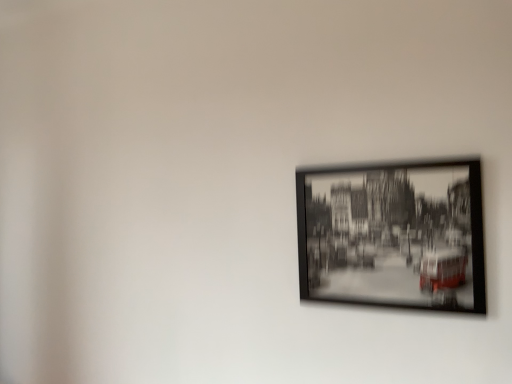
You are a GUI agent. You are given a task and a screenshot of the screen. Output one action in this format:
    pyautogui.click(x=<x>, y=<y>)
    Task: Click on the black matte picture frame at upper right
    This screenshot has width=512, height=384.
    Given the screenshot: What is the action you would take?
    pyautogui.click(x=393, y=235)

This screenshot has height=384, width=512. Describe the element at coordinates (393, 235) in the screenshot. I see `black matte picture frame at upper right` at that location.

The height and width of the screenshot is (384, 512). In order to click on black matte picture frame at upper right in this screenshot , I will do `click(393, 235)`.